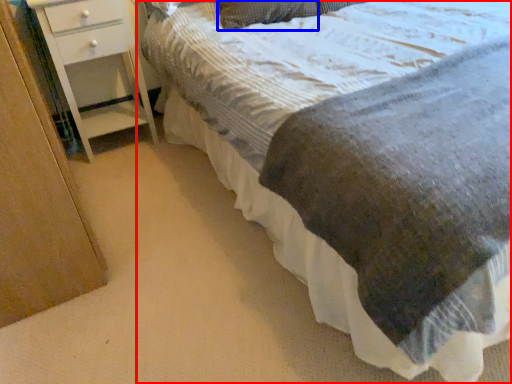
Question: Which object appears farthest to the camera in this image, bed (highlighted by a red box) or pillow (highlighted by a blue box)?

Choices:
 (A) bed
 (B) pillow

Answer: (B)